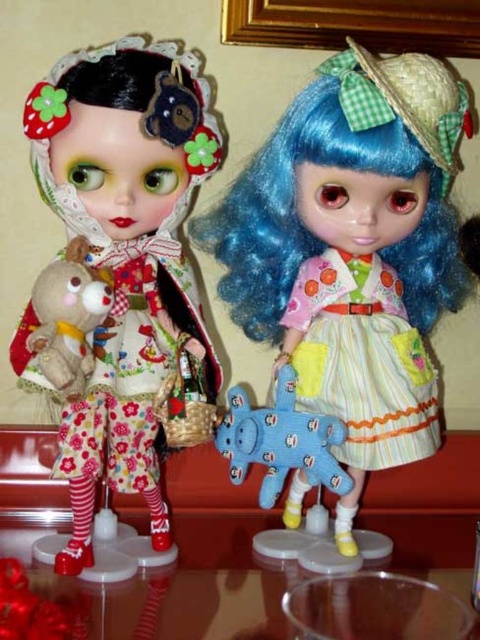
You are a fashion designer observing two dolls dressed in different styles. The dolls are wearing the floral fabric dress at left and the pastel striped fabric dress at right. Which dress is bigger in size?

The floral fabric dress at left is larger in size compared to the pastel striped fabric dress at right.

You are a toy collector who wants to place a new 30 cm tall doll between the floral fabric dress at left and the transparent plastic table at lower center. Will there be enough space for the doll to fit between them?

The distance between the floral fabric dress at left and the transparent plastic table at lower center is 28.31 centimeters. Since the doll is 30 cm tall, it will not fit in the available space.

You are arranging a doll display and need to place a small vase between the floral fabric dress at left and the transparent plastic table at lower center. Based on their positions, where should you place the vase?

The vase should be placed between the floral fabric dress at left and the transparent plastic table at lower center, as the floral fabric dress at left is to the left of the transparent plastic table at lower center.